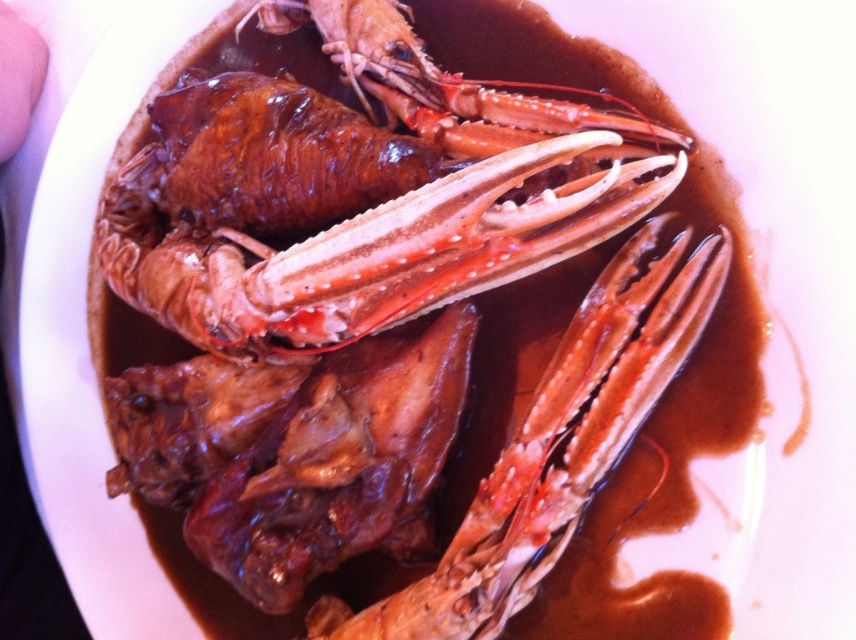
Question: Can you confirm if shiny brown crab at center is wider than shiny brown lobster at center?

Choices:
 (A) no
 (B) yes

Answer: (B)

Question: Which point is farther to the camera?

Choices:
 (A) (613, 339)
 (B) (428, 288)
 (C) (409, 268)

Answer: (A)

Question: Is shiny brown crab at center to the left of pink flesh at upper left from the viewer's perspective?

Choices:
 (A) yes
 (B) no

Answer: (B)

Question: Is shiny brown crab at center below pink flesh at upper left?

Choices:
 (A) yes
 (B) no

Answer: (A)

Question: Which object is closer to the camera taking this photo?

Choices:
 (A) shiny brown lobster at center
 (B) pink flesh at upper left

Answer: (A)

Question: Which object is farther from the camera taking this photo?

Choices:
 (A) shiny orange lobster claw at center
 (B) shiny brown lobster at center

Answer: (A)